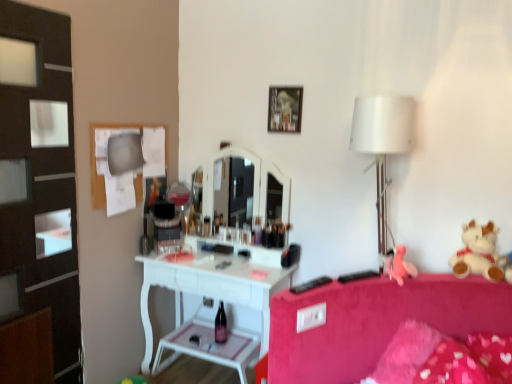
Question: Can you confirm if white plush teddy bear at right is thinner than pink fabric teddy bear at right?

Choices:
 (A) no
 (B) yes

Answer: (A)

Question: Is white plush teddy bear at right closer to camera compared to pink fabric teddy bear at right?

Choices:
 (A) yes
 (B) no

Answer: (A)

Question: From the image's perspective, would you say white plush teddy bear at right is shown under pink fabric teddy bear at right?

Choices:
 (A) no
 (B) yes

Answer: (A)

Question: Is white plush teddy bear at right oriented towards pink fabric teddy bear at right?

Choices:
 (A) no
 (B) yes

Answer: (A)

Question: Considering the relative sizes of white plush teddy bear at right and pink fabric teddy bear at right in the image provided, is white plush teddy bear at right bigger than pink fabric teddy bear at right?

Choices:
 (A) yes
 (B) no

Answer: (A)

Question: Is point (394, 350) closer or farther from the camera than point (217, 319)?

Choices:
 (A) closer
 (B) farther

Answer: (A)

Question: Considering their positions, is fluffy pink pillow at lower right located in front of or behind matte glass bottle at center?

Choices:
 (A) behind
 (B) front

Answer: (B)

Question: Looking at their shapes, would you say fluffy pink pillow at lower right is wider or thinner than matte glass bottle at center?

Choices:
 (A) thin
 (B) wide

Answer: (B)

Question: Considering the relative positions of fluffy pink pillow at lower right and matte glass bottle at center in the image provided, is fluffy pink pillow at lower right to the left or to the right of matte glass bottle at center?

Choices:
 (A) right
 (B) left

Answer: (A)

Question: In the image, is black plastic remote control at lower right, positioned as the second remote control in left-to-right order, positioned in front of or behind white fabric lampshade at right?

Choices:
 (A) behind
 (B) front

Answer: (A)

Question: In terms of width, does black plastic remote control at lower right, positioned as the second remote control in left-to-right order, look wider or thinner when compared to white fabric lampshade at right?

Choices:
 (A) wide
 (B) thin

Answer: (B)

Question: Is black plastic remote control at lower right, positioned as the second remote control in left-to-right order, taller or shorter than white fabric lampshade at right?

Choices:
 (A) tall
 (B) short

Answer: (B)

Question: Do you think black plastic remote control at lower right, positioned as the second remote control in left-to-right order, is within white fabric lampshade at right, or outside of it?

Choices:
 (A) inside
 (B) outside

Answer: (B)

Question: Is white plush teddy bear at right wider or thinner than matte glass bottle at center?

Choices:
 (A) thin
 (B) wide

Answer: (B)

Question: In the image, is white plush teddy bear at right positioned in front of or behind matte glass bottle at center?

Choices:
 (A) behind
 (B) front

Answer: (B)